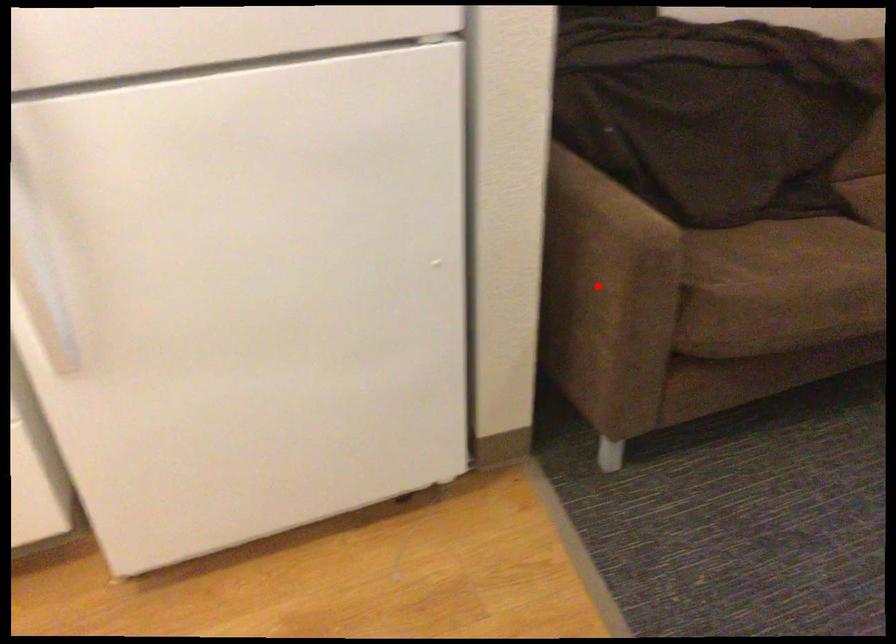
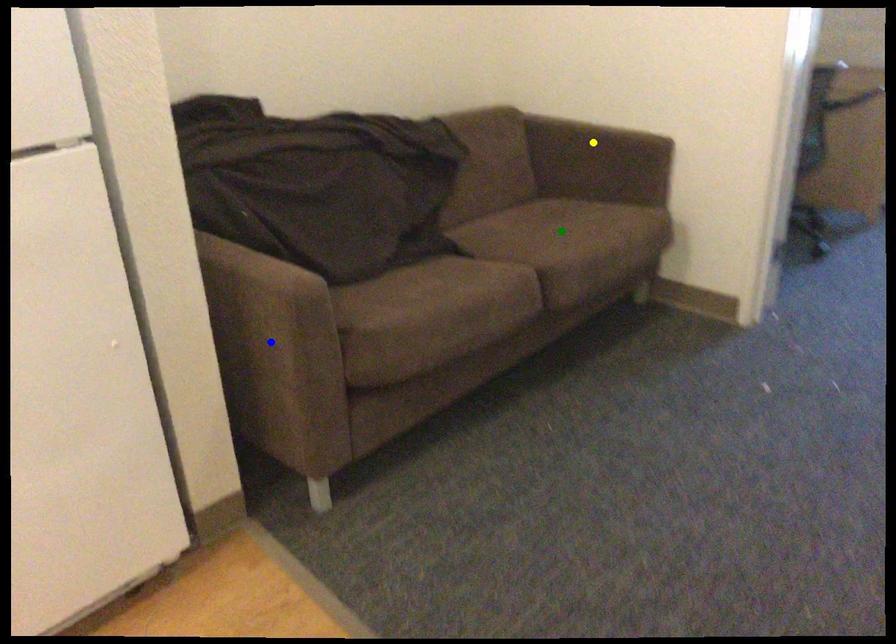
Question: I am providing you with two images of the same scene from different viewpoints. A red point is marked on the first image. You are given multiple points on the second image. Which spot in image 2 lines up with the point in image 1?

Choices:
 (A) yellow point
 (B) green point
 (C) blue point

Answer: (C)